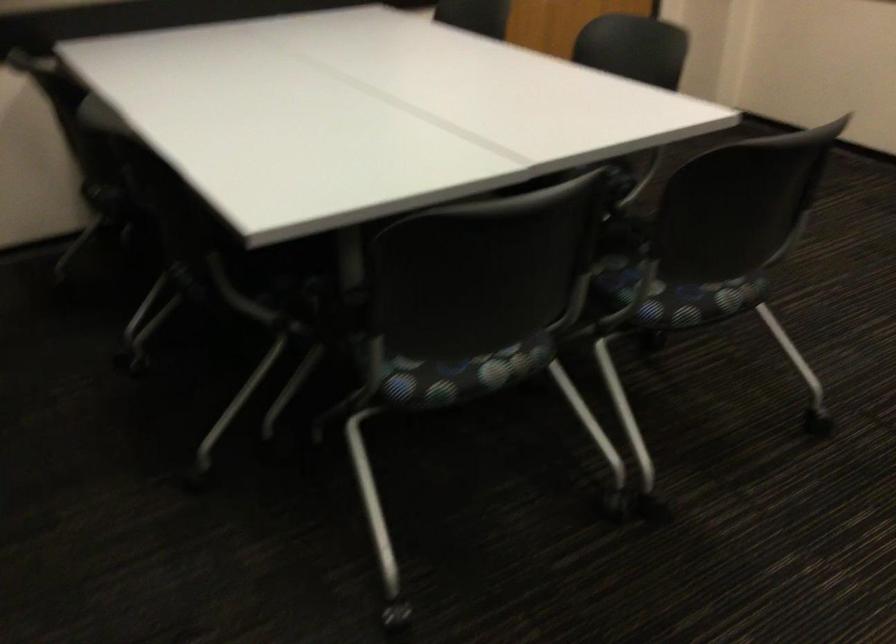
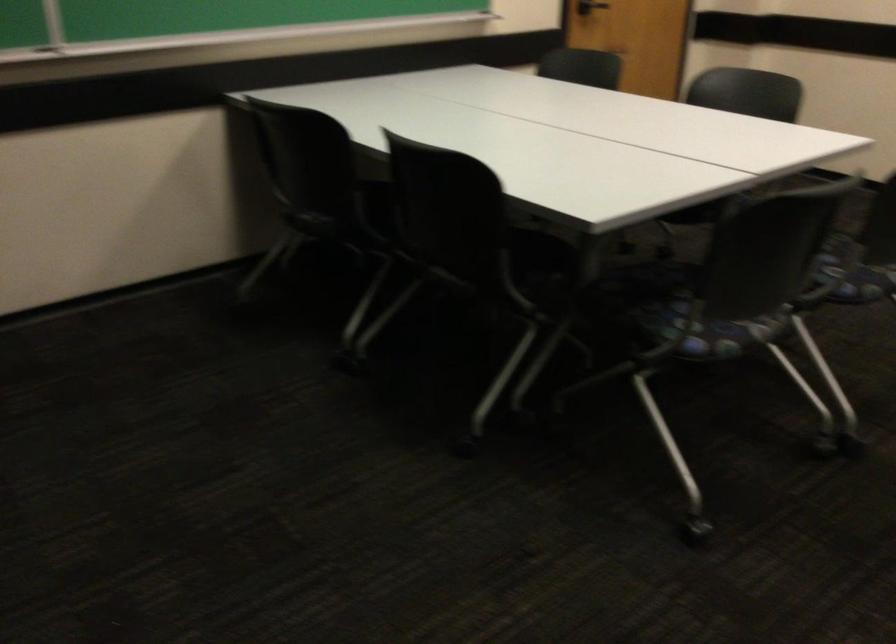
Find the pixel in the second image that matches point 640,295 in the first image.

(853, 272)